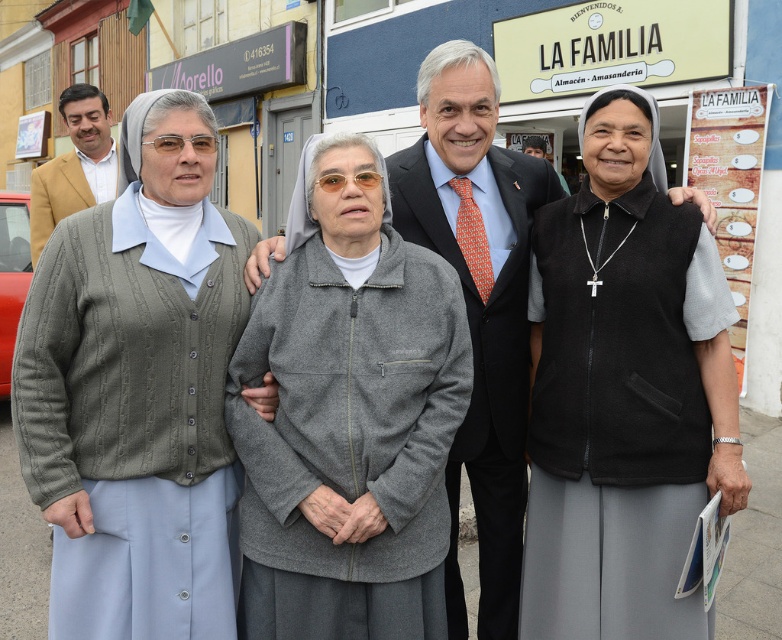
You are a fashion designer observing the group of four individuals in front of the building. You need to determine the spatial relationship between the knitted gray cardigan at center and the matte tan blazer at left. Which one is positioned lower in the image?

The knitted gray cardigan at center is located below the matte tan blazer at left, so it is positioned lower in the image.

You are a tailor observing the group in front of the building. You need to determine which clothing item is taller between the black matte vest at center and the gray fleece jacket at center. Which one is taller?

The black matte vest at center is taller than the gray fleece jacket at center according to the description.

You are a photographer trying to capture a clear photo of both the black matte vest at center and the gray fleece jacket at center. Since you can only focus on one object at a time, which one should you focus on to ensure it appears sharp in the photo?

You should focus on the black matte vest at center because it is closer to the viewer than the gray fleece jacket at center, so focusing on it will keep it sharp while the background object may appear slightly blurred.